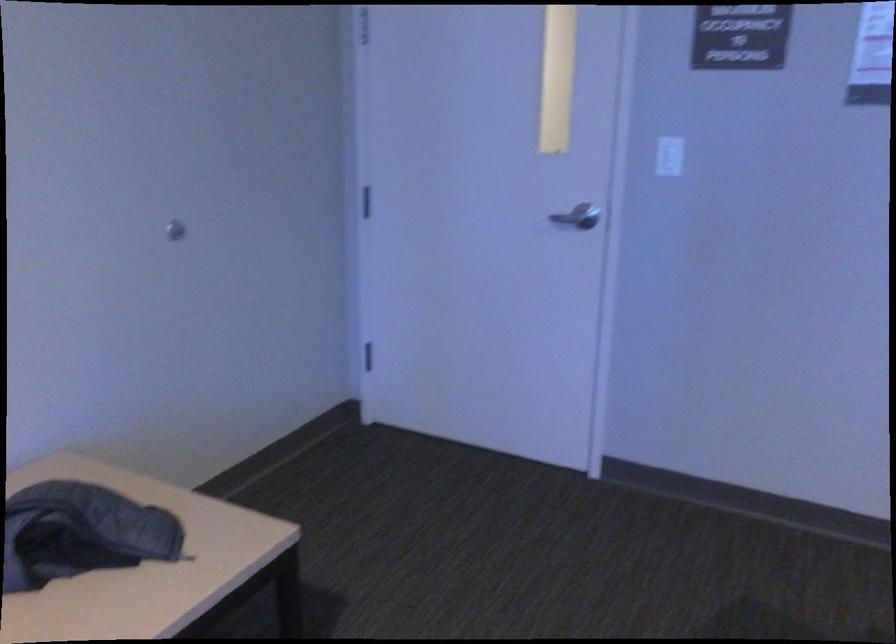
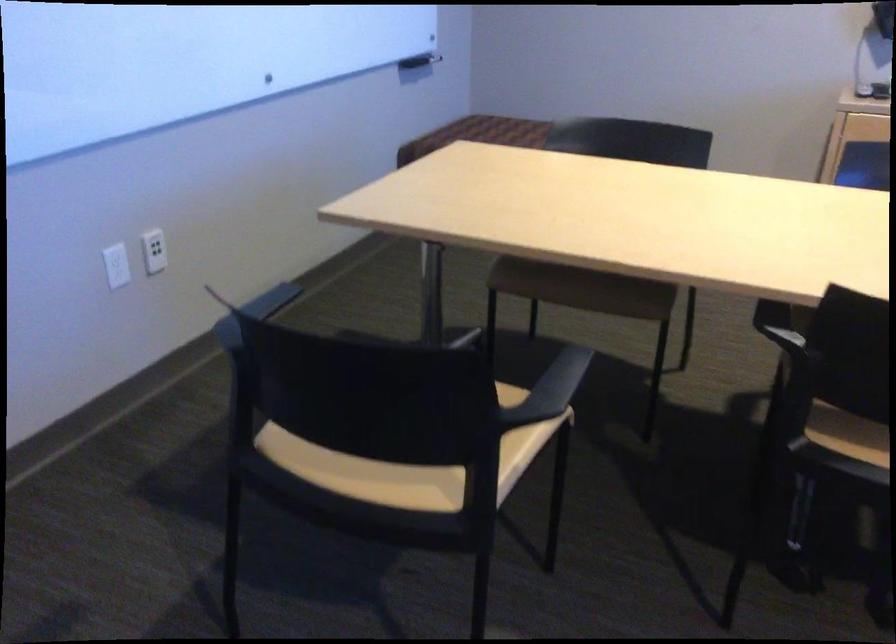
In the scene shown: First-person continuous shooting, in which direction is the camera rotating?

The rotation direction of the camera is right-down.